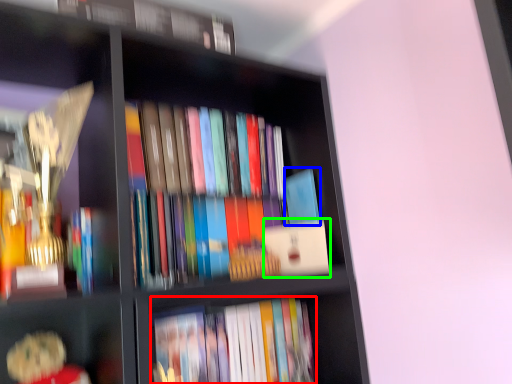
Question: Considering the real-world distances, which object is closest to book (highlighted by a red box)? paperback book (highlighted by a blue box) or paperback book (highlighted by a green box).

Choices:
 (A) paperback book
 (B) paperback book

Answer: (B)